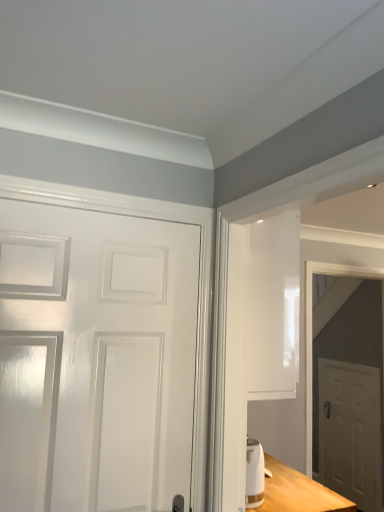
Question: Considering the relative sizes of white glossy door at left, acting as the 1th door starting from the front, and white matte door at right, which is counted as the second door, starting from the top, in the image provided, is white glossy door at left, acting as the 1th door starting from the front, thinner than white matte door at right, which is counted as the second door, starting from the top,?

Choices:
 (A) no
 (B) yes

Answer: (A)

Question: Considering the relative sizes of white glossy door at left, acting as the 1th door starting from the front, and white matte door at right, which is the first door from right to left, in the image provided, is white glossy door at left, acting as the 1th door starting from the front, shorter than white matte door at right, which is the first door from right to left,?

Choices:
 (A) no
 (B) yes

Answer: (B)

Question: Considering the relative positions of white glossy door at left, which is the second door in bottom-to-top order, and white matte door at right, which is the 1th door in back-to-front order, in the image provided, is white glossy door at left, which is the second door in bottom-to-top order, to the right of white matte door at right, which is the 1th door in back-to-front order, from the viewer's perspective?

Choices:
 (A) yes
 (B) no

Answer: (B)

Question: Can we say white glossy door at left, the 1th door viewed from the top, lies outside white matte door at right, which is the first door from right to left?

Choices:
 (A) no
 (B) yes

Answer: (B)

Question: Would you say white glossy door at left, the second door viewed from the back, contains white matte door at right, which is the 1th door in back-to-front order?

Choices:
 (A) yes
 (B) no

Answer: (B)

Question: From a real-world perspective, is white glossy door at right above or below white glossy door at left, positioned as the 2th door in right-to-left order?

Choices:
 (A) above
 (B) below

Answer: (B)

Question: From the image's perspective, is white glossy door at right located above or below white glossy door at left, placed as the 1th door when sorted from left to right?

Choices:
 (A) above
 (B) below

Answer: (B)

Question: Considering their positions, is white glossy door at right located in front of or behind white glossy door at left, positioned as the 2th door in right-to-left order?

Choices:
 (A) front
 (B) behind

Answer: (B)

Question: Is point (345, 268) closer or farther from the camera than point (44, 451)?

Choices:
 (A) closer
 (B) farther

Answer: (B)

Question: Visually, is white glossy door at left, positioned as the 2th door in right-to-left order, positioned to the left or to the right of white glossy door at right?

Choices:
 (A) right
 (B) left

Answer: (B)

Question: From a real-world perspective, relative to white glossy door at right, is white glossy door at left, which is the second door in bottom-to-top order, vertically above or below?

Choices:
 (A) below
 (B) above

Answer: (B)

Question: Relative to white glossy door at right, is white glossy door at left, the second door viewed from the back, in front or behind?

Choices:
 (A) behind
 (B) front

Answer: (B)

Question: Based on their sizes in the image, would you say white glossy door at left, the 1th door viewed from the top, is bigger or smaller than white glossy door at right?

Choices:
 (A) big
 (B) small

Answer: (B)

Question: Is white glossy door at left, which is the second door in bottom-to-top order, to the left or to the right of white matte door at right, the 2th door positioned from the front, in the image?

Choices:
 (A) right
 (B) left

Answer: (B)

Question: From the image's perspective, is white glossy door at left, acting as the 1th door starting from the front, positioned above or below white matte door at right, the second door positioned from the left?

Choices:
 (A) below
 (B) above

Answer: (B)